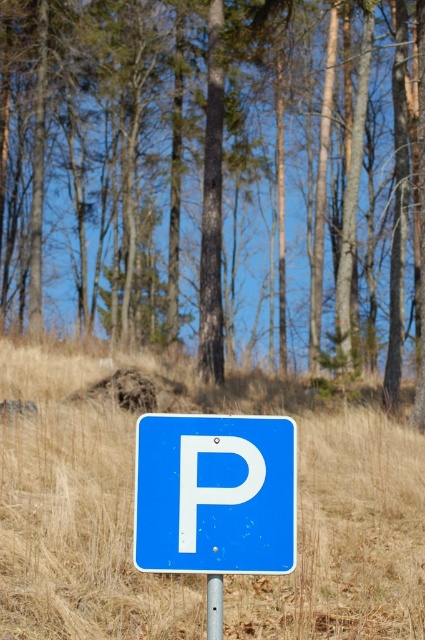
You are a painter standing in front of the blue parking sign. You want to paint the area between the dry grass at center and the white matte letter p at center. Which direction should you look to capture the space between them?

The dry grass at center is positioned on the left side of white matte letter p at center, so you should look to the left of the white matte letter p at center to capture the space between them.